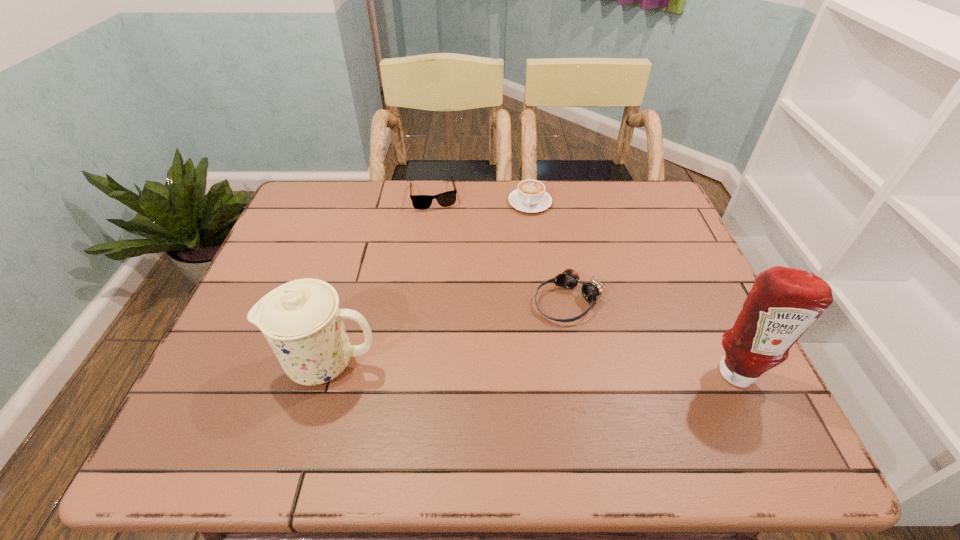
This screenshot has width=960, height=540. I want to click on vacant space at the far right corner of the desktop, so click(x=635, y=181).

Find the location of a particular element. The height and width of the screenshot is (540, 960). blank region between the sunglasses and the rightmost object is located at coordinates (585, 283).

Where is `vacant region between the third farthest object and the condiment`? This screenshot has height=540, width=960. vacant region between the third farthest object and the condiment is located at coordinates (652, 336).

Where is `blank region between the chinaware and the cappuccino`? blank region between the chinaware and the cappuccino is located at coordinates (428, 283).

Locate an element on the screen. The width and height of the screenshot is (960, 540). free spot between the tallest object and the second tallest object is located at coordinates (531, 367).

Identify the location of empty location between the second tallest object and the sunglasses. The width and height of the screenshot is (960, 540). (380, 279).

Where is `free area in between the tallest object and the sunglasses`? free area in between the tallest object and the sunglasses is located at coordinates (585, 283).

The height and width of the screenshot is (540, 960). Identify the location of free space between the second tallest object and the third nearest object. pyautogui.click(x=447, y=332).

The width and height of the screenshot is (960, 540). Identify the location of vacant point located between the sunglasses and the tallest object. (585, 283).

This screenshot has width=960, height=540. I want to click on empty space that is in between the condiment and the cappuccino, so click(633, 287).